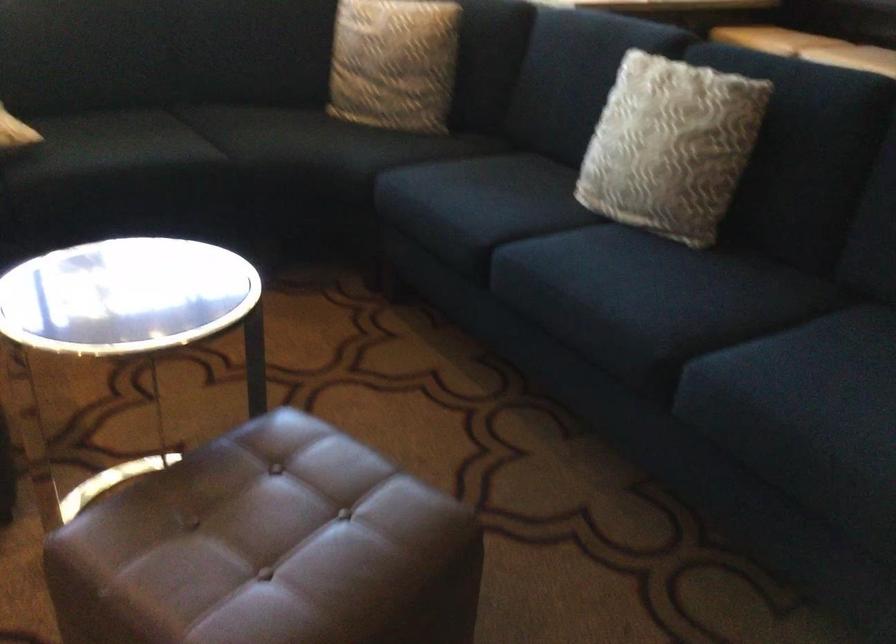
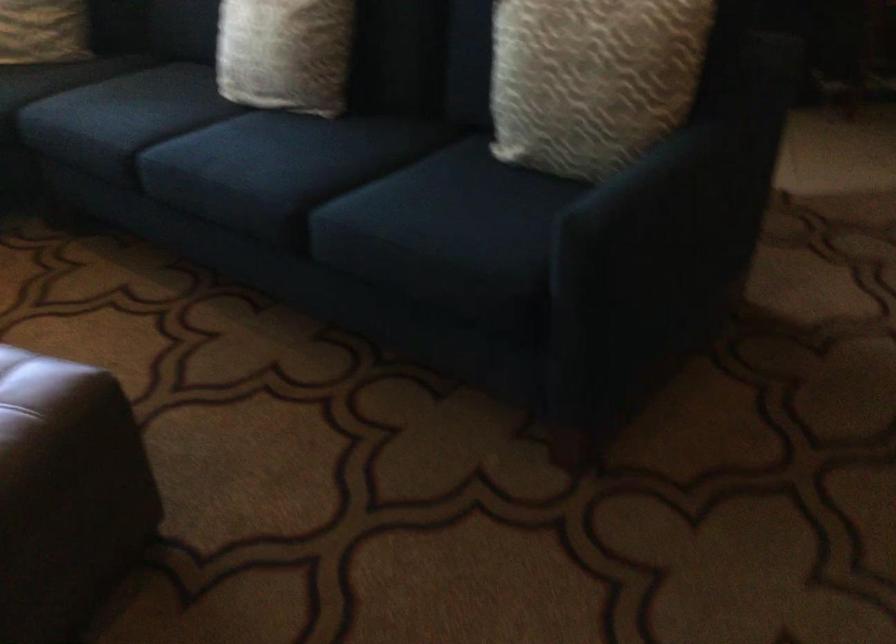
In the second image, find the point that corresponds to point 609,277 in the first image.

(245, 154)